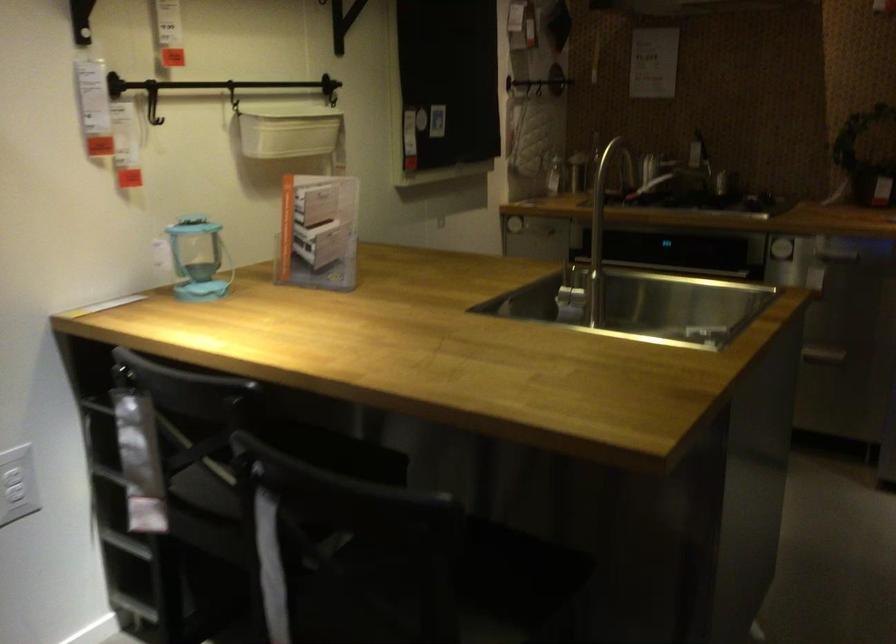
What are the coordinates of `metal faucet handle` in the screenshot? It's located at (580, 295).